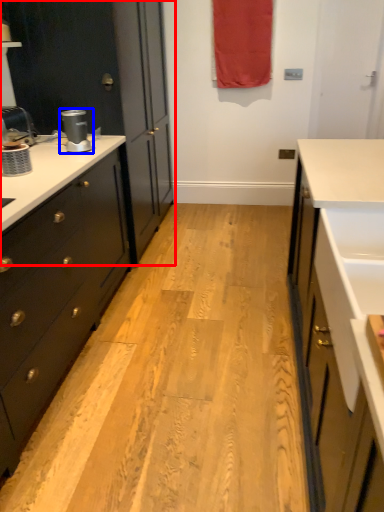
Question: Which point is closer to the camera, cabinetry (highlighted by a red box) or coffee machine (highlighted by a blue box)?

Choices:
 (A) cabinetry
 (B) coffee machine

Answer: (B)